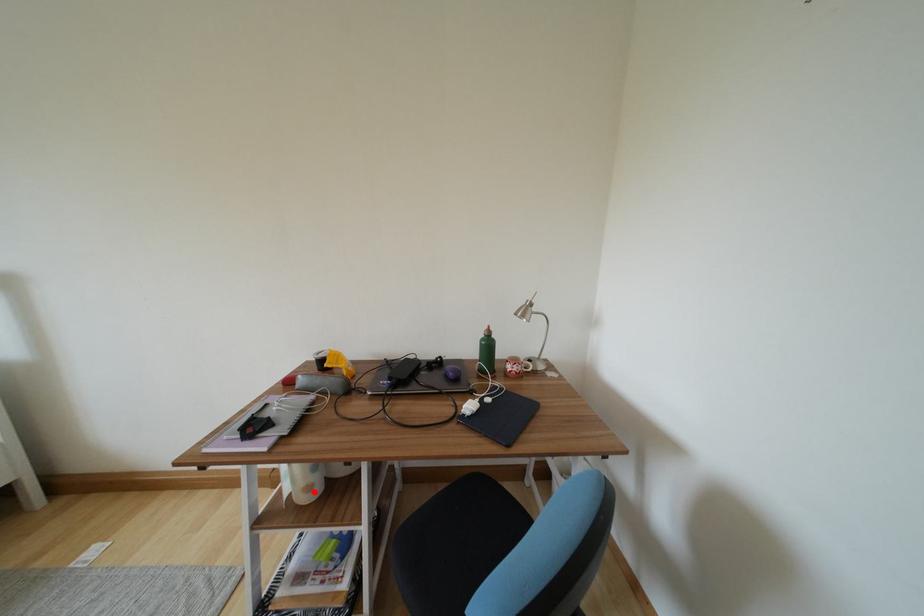
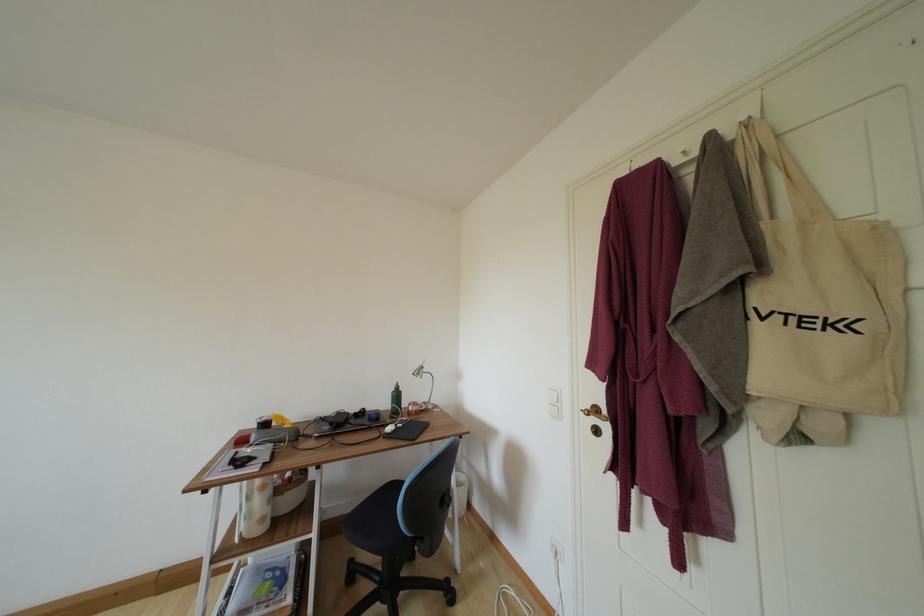
Where in the second image is the point corresponding to the highlighted location from the first image?

(266, 524)